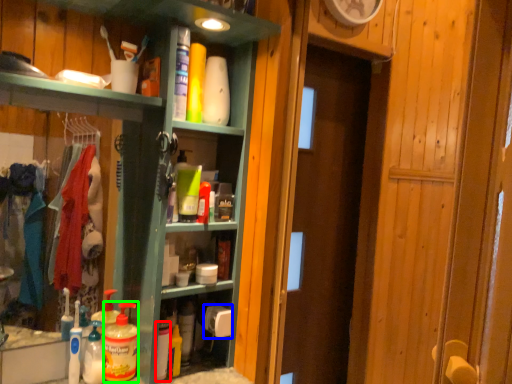
Question: Based on their relative distances, which object is farther from cleaning product (highlighted by a red box)? Choose from toilet paper (highlighted by a blue box) and cleaning product (highlighted by a green box).

Choices:
 (A) toilet paper
 (B) cleaning product

Answer: (A)